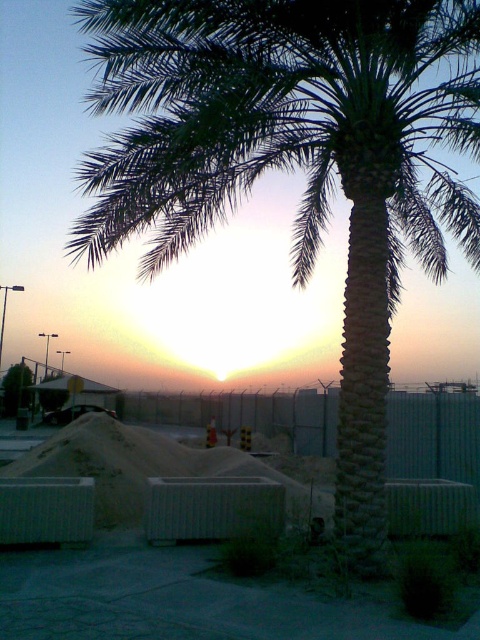
Can you confirm if white concrete mound at center is positioned to the right of green leafy palm at center?

Indeed, white concrete mound at center is positioned on the right side of green leafy palm at center.

Can you confirm if white concrete mound at center is shorter than green leafy palm at center?

Indeed, white concrete mound at center has a lesser height compared to green leafy palm at center.

What do you see at coordinates (140, 465) in the screenshot? Image resolution: width=480 pixels, height=640 pixels. I see `white concrete mound at center` at bounding box center [140, 465].

This screenshot has width=480, height=640. Find the location of `white concrete mound at center`. white concrete mound at center is located at coordinates (140, 465).